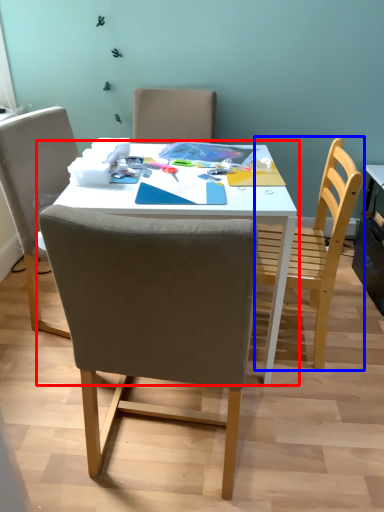
Question: Among these objects, which one is nearest to the camera, table (highlighted by a red box) or chair (highlighted by a blue box)?

Choices:
 (A) table
 (B) chair

Answer: (A)